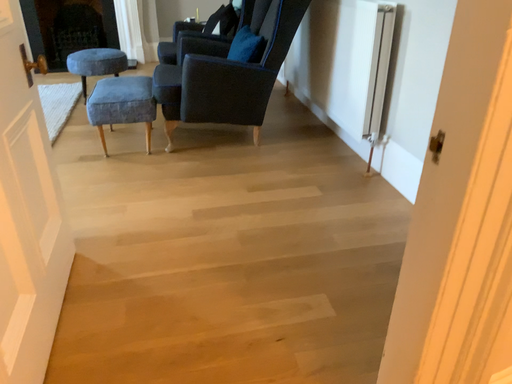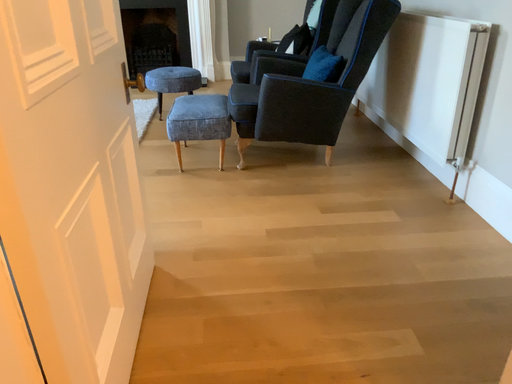
Question: Which way did the camera rotate in the video?

Choices:
 (A) rotated right
 (B) rotated left

Answer: (B)